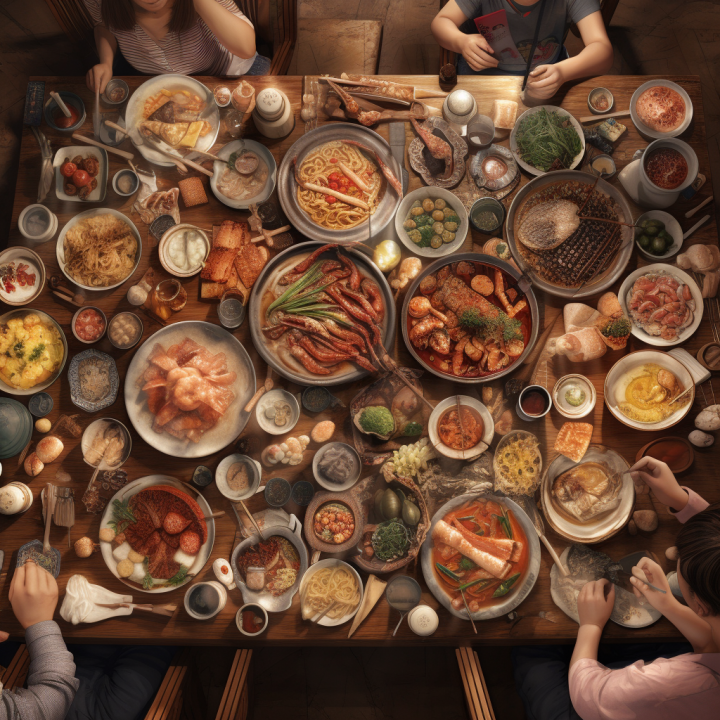
You are a GUI agent. You are given a task and a screenshot of the screen. Output one action in this format:
    pyautogui.click(x=<x>, y=<y>)
    Task: Click on the floor
    
    Given the screenshot: What is the action you would take?
    pyautogui.click(x=399, y=693), pyautogui.click(x=648, y=37), pyautogui.click(x=405, y=24)